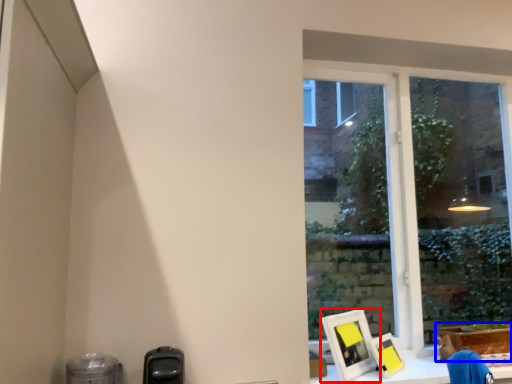
Question: Among these objects, which one is nearest to the camera, picture frame (highlighted by a red box) or cardboard box (highlighted by a blue box)?

Choices:
 (A) picture frame
 (B) cardboard box

Answer: (A)